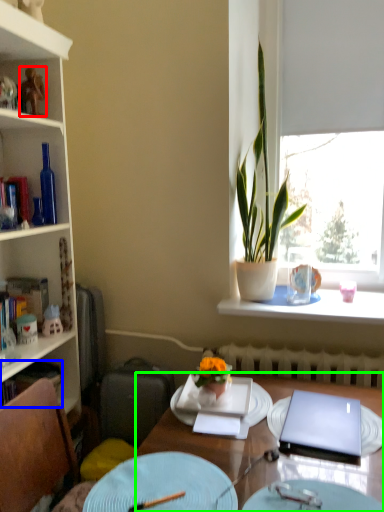
Question: Which is nearer to the toy (highlighted by a red box)? book (highlighted by a blue box) or desk (highlighted by a green box).

Choices:
 (A) book
 (B) desk

Answer: (A)